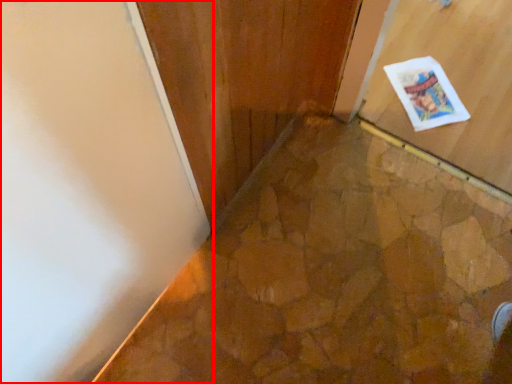
Question: Observing the image, what is the correct spatial positioning of door (annotated by the red box) in reference to postcard?

Choices:
 (A) left
 (B) right

Answer: (A)